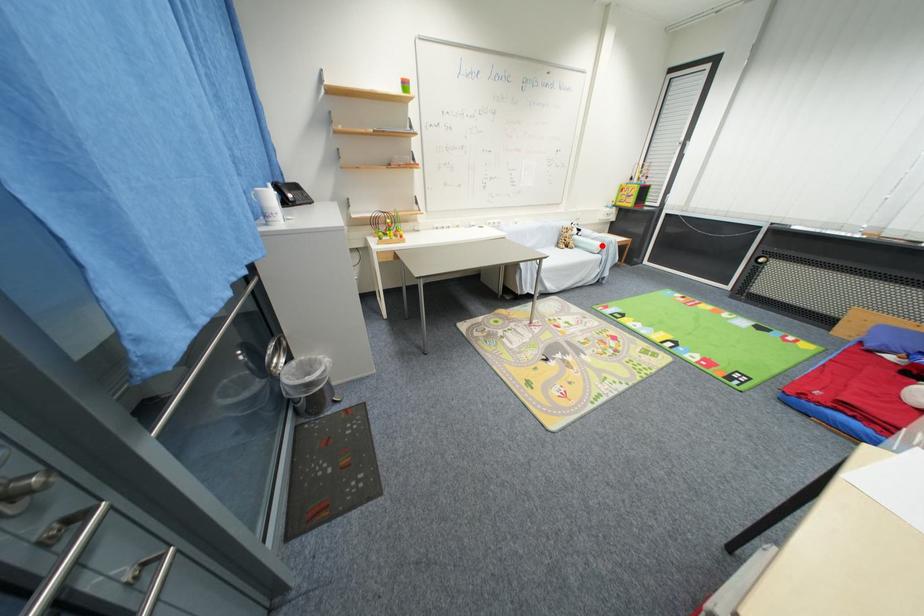
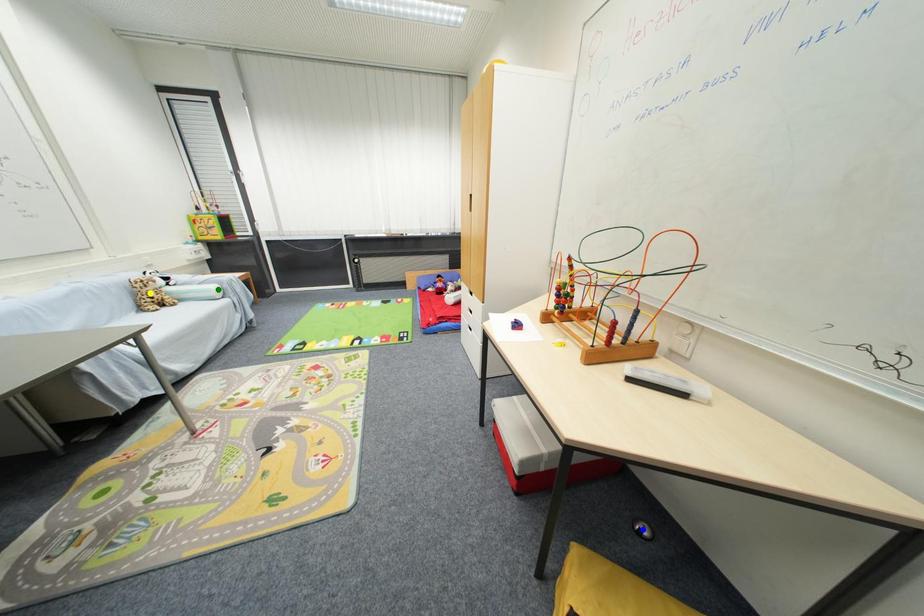
Question: I am providing you with two images of the same scene from different viewpoints. A red point is marked on the first image. You are given multiple points on the second image. Can you choose the point in image 2 that corresponds to the point in image 1?

Choices:
 (A) yellow point
 (B) blue point
 (C) green point

Answer: (C)